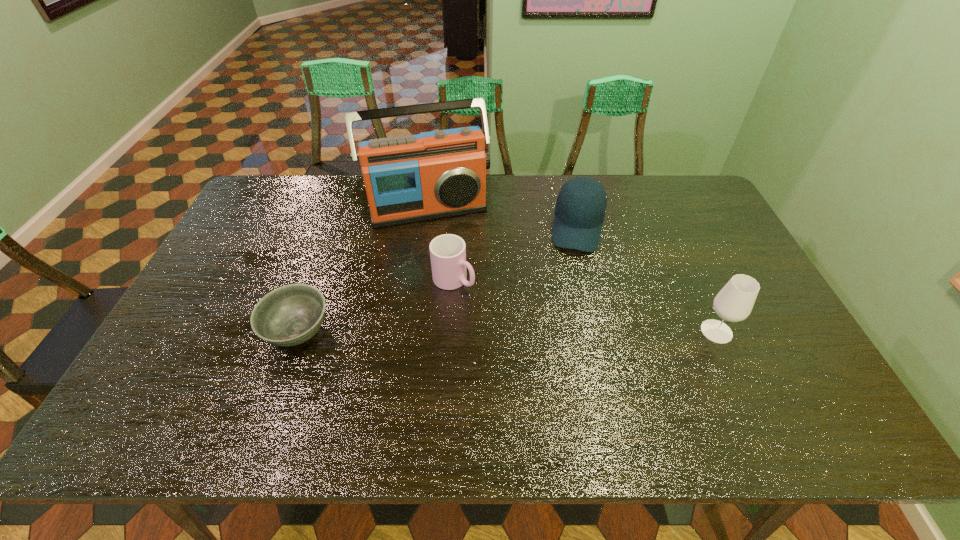
I want to click on vacant space situated 0.300m on the front-facing side of the third tallest object, so click(x=566, y=332).

Locate an element on the screen. This screenshot has height=540, width=960. free space located on the front-facing side of the third tallest object is located at coordinates (571, 298).

Image resolution: width=960 pixels, height=540 pixels. I want to click on vacant space situated on the front-facing side of the third tallest object, so click(565, 341).

The image size is (960, 540). I want to click on vacant space located with the handle on the side of the cup, so click(x=489, y=302).

The image size is (960, 540). Find the location of `free region located 0.080m with the handle on the side of the cup`. free region located 0.080m with the handle on the side of the cup is located at coordinates (492, 305).

The height and width of the screenshot is (540, 960). I want to click on vacant space located with the handle on the side of the cup, so click(x=530, y=330).

At what (x,y) coordinates should I click in order to perform the action: click on vacant space located on the front-facing side of the radio receiver. Please return your answer as a coordinate pair (x, y). The height and width of the screenshot is (540, 960). Looking at the image, I should click on (444, 242).

Identify the location of free region located 0.290m on the front-facing side of the radio receiver. (460, 293).

Locate an element on the screen. The height and width of the screenshot is (540, 960). vacant region located on the front-facing side of the radio receiver is located at coordinates (452, 266).

Locate an element on the screen. baseball cap that is positioned at the far edge is located at coordinates (580, 209).